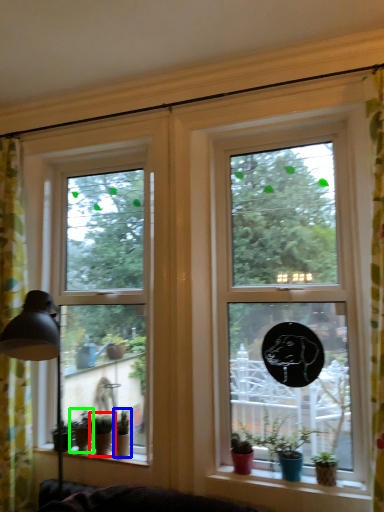
Question: Which object is positioned farthest from houseplant (highlighted by a red box)? Select from houseplant (highlighted by a blue box) and houseplant (highlighted by a green box).

Choices:
 (A) houseplant
 (B) houseplant

Answer: (A)